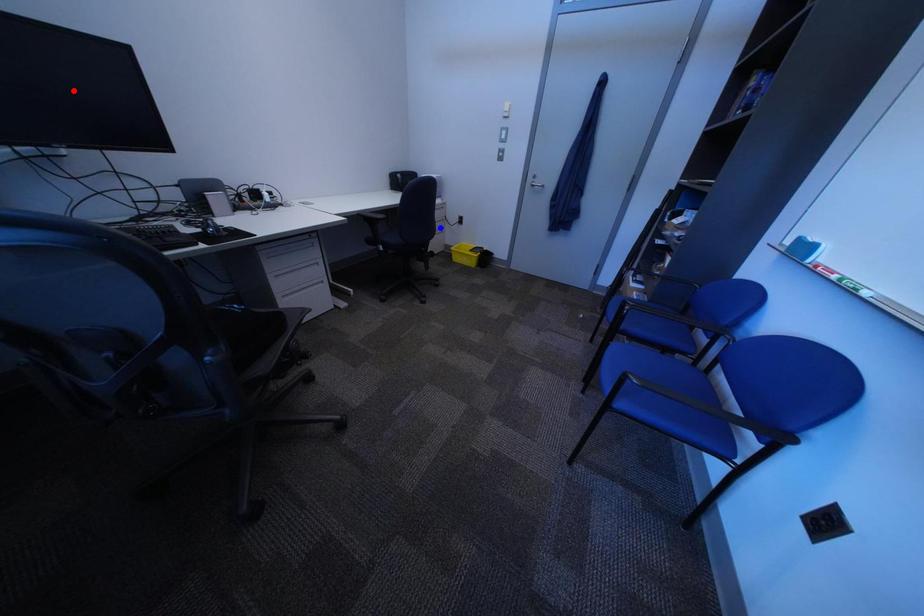
Question: In the image, two points are highlighted. Which point is nearer to the camera? Reply with the corresponding letter.

Choices:
 (A) blue point
 (B) red point

Answer: (B)